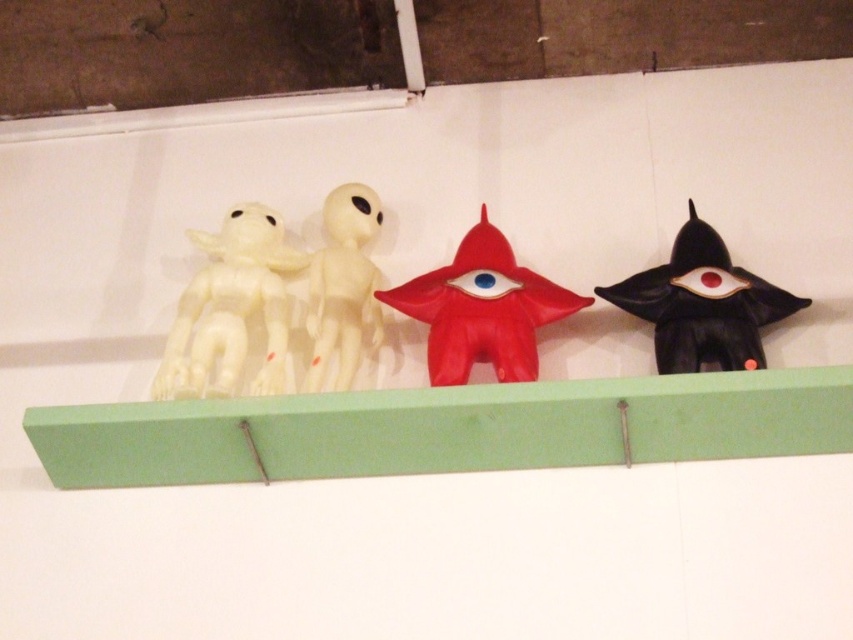
You are organizing a shelf and need to place a new item between the white matte toy at left and the red matte alien at center. Based on their positions, where should the new item be placed?

The new item should be placed between the white matte toy at left and the red matte alien at center since the white matte toy at left is in front of the red matte alien at center, creating space in between for the new item.

You are an interior designer arranging items on a shelf. You have a green wood at center and a white matte alien at center. According to the scene description, which object is positioned to the right of the other?

The green wood at center is to the right of the white matte alien at center according to the description.

You are an interior designer arranging items on a shelf. You have a green wood at center and a white matte alien at center. Based on their positions, which object would cast a shadow further to the back of the shelf?

The green wood at center is in front of the white matte alien at center, so its shadow would be cast further back on the shelf.